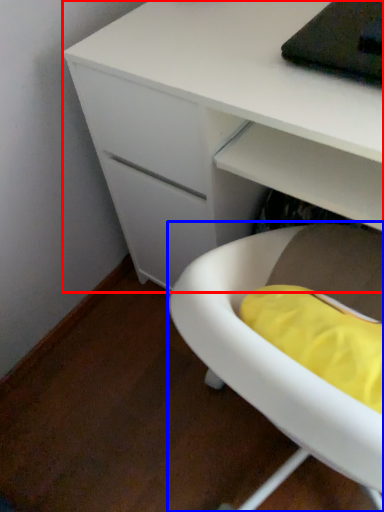
Question: Which object is closer to the camera taking this photo, desk (highlighted by a red box) or furniture (highlighted by a blue box)?

Choices:
 (A) desk
 (B) furniture

Answer: (B)